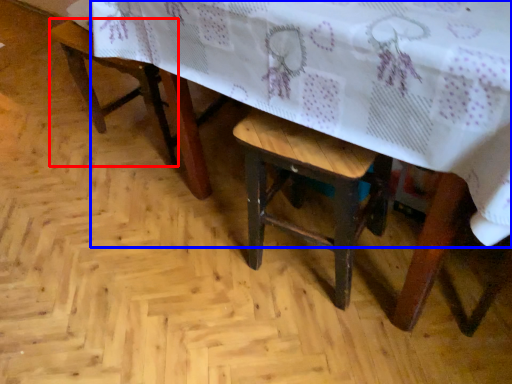
Question: Among these objects, which one is farthest to the camera, armchair (highlighted by a red box) or table (highlighted by a blue box)?

Choices:
 (A) armchair
 (B) table

Answer: (A)